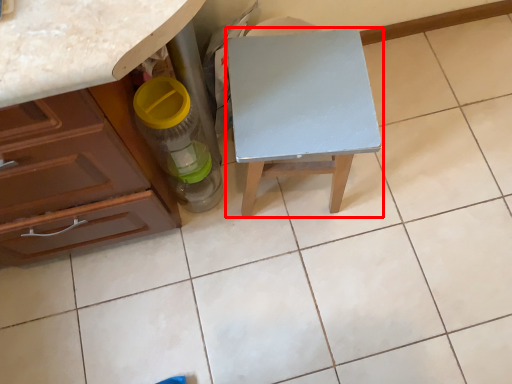
Question: Observing the image, what is the correct spatial positioning of table (annotated by the red box) in reference to bottle?

Choices:
 (A) right
 (B) left

Answer: (A)